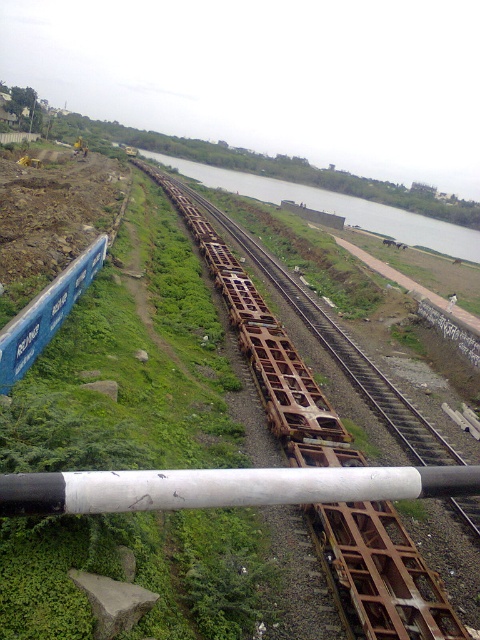
Looking at this image, you are a photographer planning to capture a wide landscape shot of the white matte pole at center and the green grassy river at center. Given their sizes, which object should you focus on to ensure it dominates the photo composition?

The green grassy river at center is larger than the white matte pole at center, so focusing on it will make it the dominant element in the photo composition.

You are a photographer standing on the bridge and want to capture both the green grassy river at center and the blue matte freight car at left in the same frame. Which object should you focus on first to ensure both are in focus?

You should focus on the blue matte freight car at left first because it is closer to you than the green grassy river at center, which is further away. By focusing on the closer object, the further one will still be within the depth of field.

You are a photographer positioned at the center of the image. You want to capture a photo that includes both the white matte pole at center and the green grassy river at center. Based on their positions, which object should you pan your camera towards first to ensure both are in frame?

Since the white matte pole at center is to the left of the green grassy river at center, you should pan your camera towards the white matte pole at center first to ensure both are included in the frame.